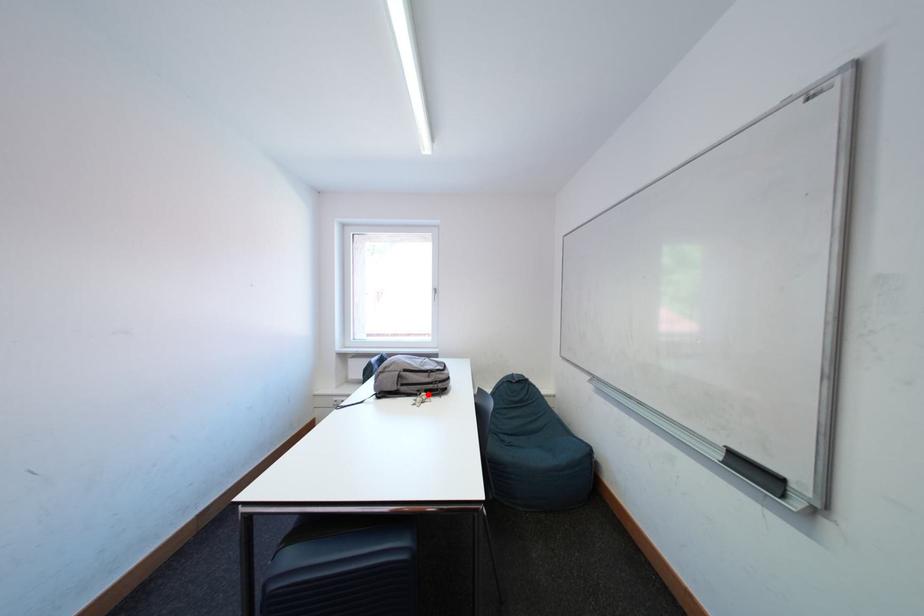
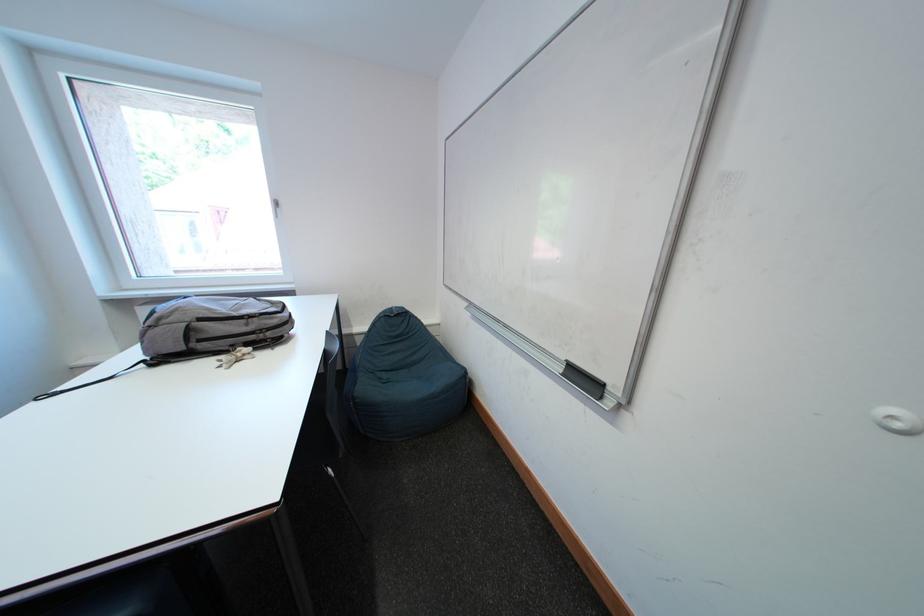
Question: A red point is marked in image1. In image2, is the corresponding 3D point closer to the camera or farther? Reply with the corresponding letter.

Choices:
 (A) The corresponding 3D point is closer.
 (B) The corresponding 3D point is farther.

Answer: (A)